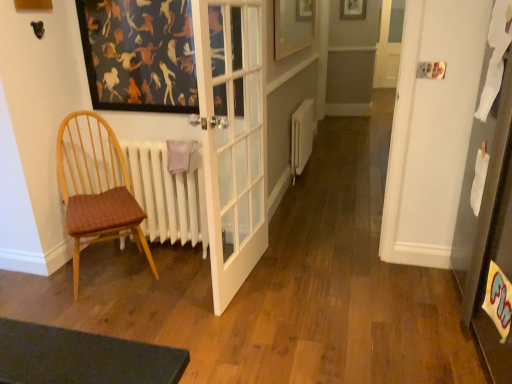
Question: Should I look upward or downward to see woven fabric chair at left?

Choices:
 (A) down
 (B) up

Answer: (A)

Question: Can you confirm if white matte radiator at center is bigger than white matte radiator at left?

Choices:
 (A) yes
 (B) no

Answer: (B)

Question: Is white matte radiator at center thinner than white matte radiator at left?

Choices:
 (A) yes
 (B) no

Answer: (A)

Question: Considering the relative positions of white matte radiator at center and white matte radiator at left in the image provided, is white matte radiator at center to the right of white matte radiator at left from the viewer's perspective?

Choices:
 (A) yes
 (B) no

Answer: (A)

Question: Is the surface of white matte radiator at center in direct contact with white matte radiator at left?

Choices:
 (A) no
 (B) yes

Answer: (A)

Question: Is white matte radiator at center taller than white matte radiator at left?

Choices:
 (A) yes
 (B) no

Answer: (B)

Question: From a real-world perspective, is white matte radiator at center on white matte radiator at left?

Choices:
 (A) no
 (B) yes

Answer: (A)

Question: Considering the relative sizes of white matte radiator at center and woven fabric chair at left in the image provided, is white matte radiator at center wider than woven fabric chair at left?

Choices:
 (A) no
 (B) yes

Answer: (A)

Question: Is white matte radiator at center thinner than woven fabric chair at left?

Choices:
 (A) no
 (B) yes

Answer: (B)

Question: Can woven fabric chair at left be found inside white matte radiator at center?

Choices:
 (A) yes
 (B) no

Answer: (B)

Question: Does white matte radiator at center touch woven fabric chair at left?

Choices:
 (A) yes
 (B) no

Answer: (B)

Question: Is white matte radiator at center to the left of woven fabric chair at left from the viewer's perspective?

Choices:
 (A) yes
 (B) no

Answer: (B)

Question: Is white matte radiator at center oriented towards woven fabric chair at left?

Choices:
 (A) no
 (B) yes

Answer: (A)

Question: Is woven fabric chair at left closer to camera compared to white matte radiator at left?

Choices:
 (A) yes
 (B) no

Answer: (A)